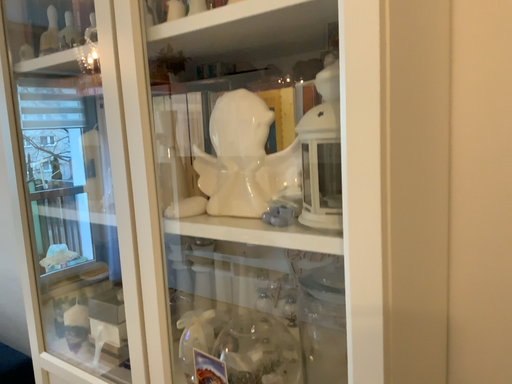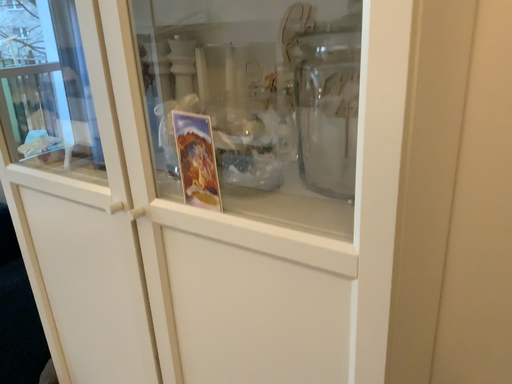
Question: Which way did the camera rotate in the video?

Choices:
 (A) rotated upward
 (B) rotated downward

Answer: (B)